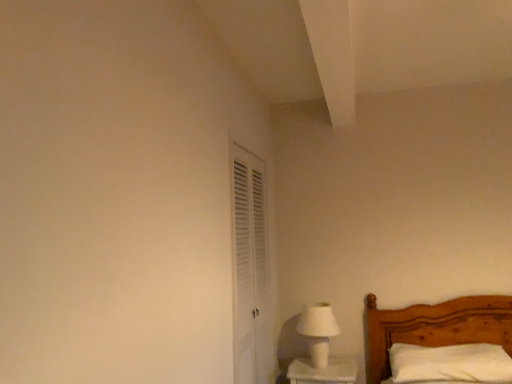
Describe the element at coordinates (450, 363) in the screenshot. I see `white soft pillow at lower right` at that location.

Image resolution: width=512 pixels, height=384 pixels. Describe the element at coordinates (250, 269) in the screenshot. I see `white louvered door at center-left` at that location.

Where is `white soft pillow at lower right`? The image size is (512, 384). white soft pillow at lower right is located at coordinates (450, 363).

Considering the positions of point (476, 370) and point (316, 361), is point (476, 370) closer or farther from the camera than point (316, 361)?

Point (476, 370) appears to be closer to the viewer than point (316, 361).

Is white soft pillow at lower right smaller than white matte table lamp at lower right?

No.

From a real-world perspective, which is physically above, white soft pillow at lower right or white matte table lamp at lower right?

white matte table lamp at lower right.

Is white matte table lamp at lower right wider than white louvered door at center-left?

Indeed, white matte table lamp at lower right has a greater width compared to white louvered door at center-left.

Is white matte table lamp at lower right looking in the opposite direction of white louvered door at center-left?

No, white matte table lamp at lower right is not facing the opposite direction of white louvered door at center-left.

At what (x,y) coordinates should I click in order to perform the action: click on table lamp below the white louvered door at center-left (from the image's perspective). Please return your answer as a coordinate pair (x, y). The height and width of the screenshot is (384, 512). Looking at the image, I should click on (318, 331).

Does white matte table lamp at lower right lie in front of white louvered door at center-left?

No, white matte table lamp at lower right is further to the viewer.

From a real-world perspective, is white louvered door at center-left positioned over white matte table lamp at lower right based on gravity?

Yes, from a real-world perspective, white louvered door at center-left is over white matte table lamp at lower right

Is white louvered door at center-left at the left side of white matte table lamp at lower right?

Yes, white louvered door at center-left is to the left of white matte table lamp at lower right.

Is white louvered door at center-left taller than white matte table lamp at lower right?

Yes.

Which object is thinner, white soft pillow at lower right or white louvered door at center-left?

With smaller width is white louvered door at center-left.

The height and width of the screenshot is (384, 512). I want to click on screen door in front of the white soft pillow at lower right, so click(250, 269).

Which is closer to the camera, (402, 348) or (265, 286)?

Point (402, 348) is closer to the camera than point (265, 286).

Measure the distance between white soft pillow at lower right and white louvered door at center-left.

white soft pillow at lower right is 3.45 feet from white louvered door at center-left.

From the image's perspective, is white louvered door at center-left on white soft pillow at lower right?

Yes, from the image's perspective, white louvered door at center-left is on top of white soft pillow at lower right.

Is white soft pillow at lower right at the back of white louvered door at center-left?

No, white louvered door at center-left is not facing away from white soft pillow at lower right.

Is white louvered door at center-left with white soft pillow at lower right?

There is a gap between white louvered door at center-left and white soft pillow at lower right.

From a real-world perspective, is white louvered door at center-left on white soft pillow at lower right?

Yes, from a real-world perspective, white louvered door at center-left is over white soft pillow at lower right

From a real-world perspective, is white matte table lamp at lower right below white soft pillow at lower right?

No, from a real-world perspective, white matte table lamp at lower right is not below white soft pillow at lower right.

Considering their positions, is white matte table lamp at lower right located in front of or behind white soft pillow at lower right?

In the image, white matte table lamp at lower right appears behind white soft pillow at lower right.

Considering the relative sizes of white matte table lamp at lower right and white soft pillow at lower right in the image provided, is white matte table lamp at lower right taller than white soft pillow at lower right?

Yes.

Does white matte table lamp at lower right turn towards white soft pillow at lower right?

No, white matte table lamp at lower right is not facing towards white soft pillow at lower right.

The width and height of the screenshot is (512, 384). In order to click on table lamp on the left side of white soft pillow at lower right in this screenshot , I will do `click(318, 331)`.

You are a GUI agent. You are given a task and a screenshot of the screen. Output one action in this format:
    pyautogui.click(x=<x>, y=<y>)
    Task: Click on the screen door above the white matte table lamp at lower right (from the image's perspective)
    The image size is (512, 384).
    Given the screenshot: What is the action you would take?
    pyautogui.click(x=250, y=269)

Based on the photo, based on their spatial positions, is white louvered door at center-left or white soft pillow at lower right closer to white matte table lamp at lower right?

white louvered door at center-left is positioned closer to the anchor white matte table lamp at lower right.

Based on their spatial positions, is white soft pillow at lower right or white louvered door at center-left closer to white matte table lamp at lower right?

white louvered door at center-left.

Estimate the real-world distances between objects in this image. Which object is further from white louvered door at center-left, white matte table lamp at lower right or white soft pillow at lower right?

white soft pillow at lower right is further to white louvered door at center-left.

From the image, which object appears to be farther from white louvered door at center-left, white soft pillow at lower right or white matte table lamp at lower right?

white soft pillow at lower right.

Based on their spatial positions, is white matte table lamp at lower right or white louvered door at center-left closer to white soft pillow at lower right?

white matte table lamp at lower right is positioned closer to the anchor white soft pillow at lower right.

From the image, which object appears to be nearer to white soft pillow at lower right, white louvered door at center-left or white matte table lamp at lower right?

The object closer to white soft pillow at lower right is white matte table lamp at lower right.

Identify the location of table lamp between white louvered door at center-left and white soft pillow at lower right. (318, 331).